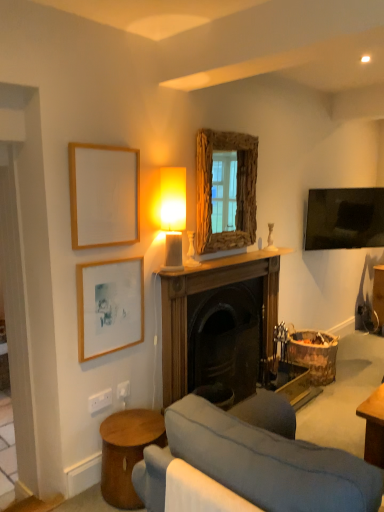
This screenshot has width=384, height=512. Identify the location of vacant space underneath rustic wood mirror at upper center (from a real-world perspective). (228, 257).